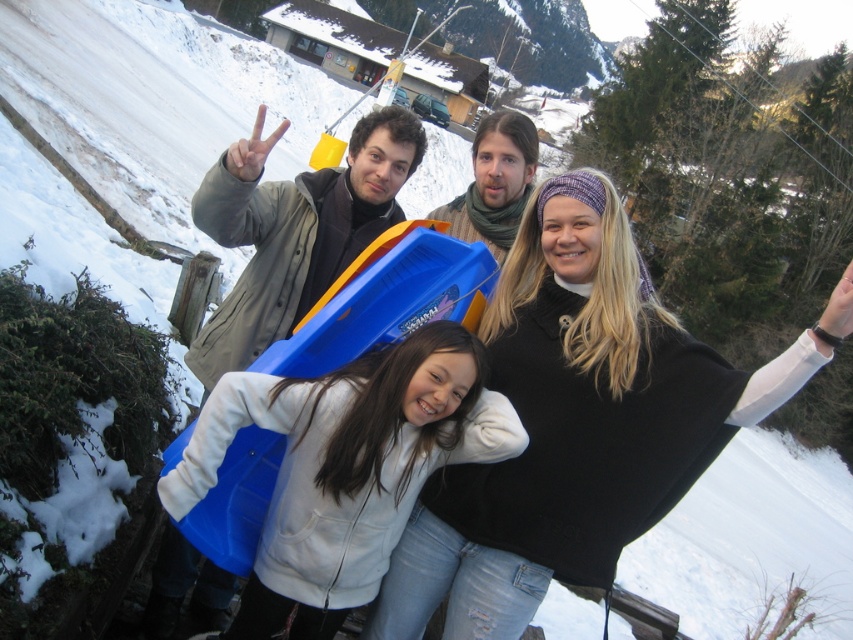
Question: Can you confirm if blue plastic sled at center is bigger than matte gray jacket at upper left?

Choices:
 (A) yes
 (B) no

Answer: (B)

Question: Where is blue plastic sled at center located in relation to matte gray jacket at upper left in the image?

Choices:
 (A) left
 (B) right

Answer: (B)

Question: Can you confirm if blue plastic sled at center is positioned below matte gray jacket at upper left?

Choices:
 (A) yes
 (B) no

Answer: (A)

Question: Among these objects, which one is farthest from the camera?

Choices:
 (A) matte gray jacket at upper left
 (B) blue plastic sled at center

Answer: (A)